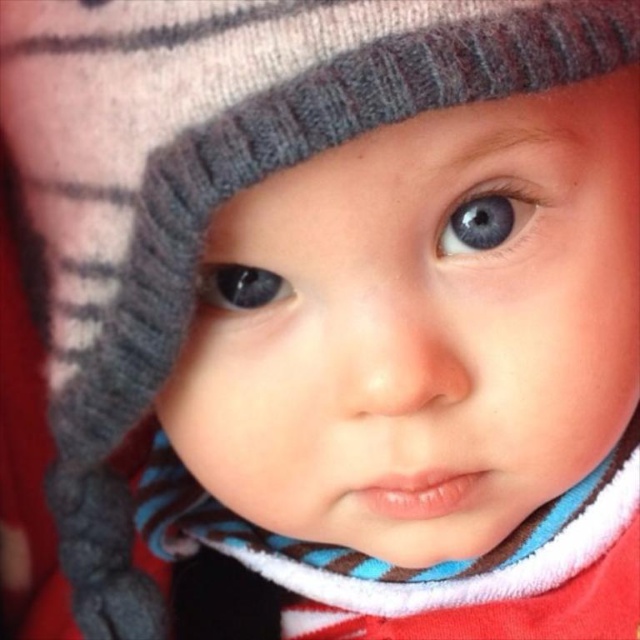
You are a photographer adjusting the focus on your camera. You want to capture both the blue striped scarf at center and the matte blue eye at center in sharp detail. Which object should you focus on first to ensure it appears clearer in the photo?

You should focus on the blue striped scarf at center first because it is closer to the viewer than the matte blue eye at center, so adjusting focus starting from the closer object ensures both can be in focus.

You are a photographer adjusting your camera settings to capture the baby in the image. The camera has a focus range of 16 inches to 18 inches. Can the blue striped scarf at center be in focus?

The blue striped scarf at center is 17.37 inches from the viewer, which falls within the camera focus range of 16 inches to 18 inches. Therefore, the blue striped scarf at center can be in focus.

From the picture: You are a photographer adjusting the focus of your camera. You need to ensure that both the blue striped scarf at center and the blue matte eye at upper center are in focus. Which object should you adjust the focus for first to ensure the smaller one is sharp?

The blue matte eye at upper center is smaller than the blue striped scarf at center, so you should focus on the blue matte eye at upper center first to ensure its sharpness before adjusting for the larger scarf.